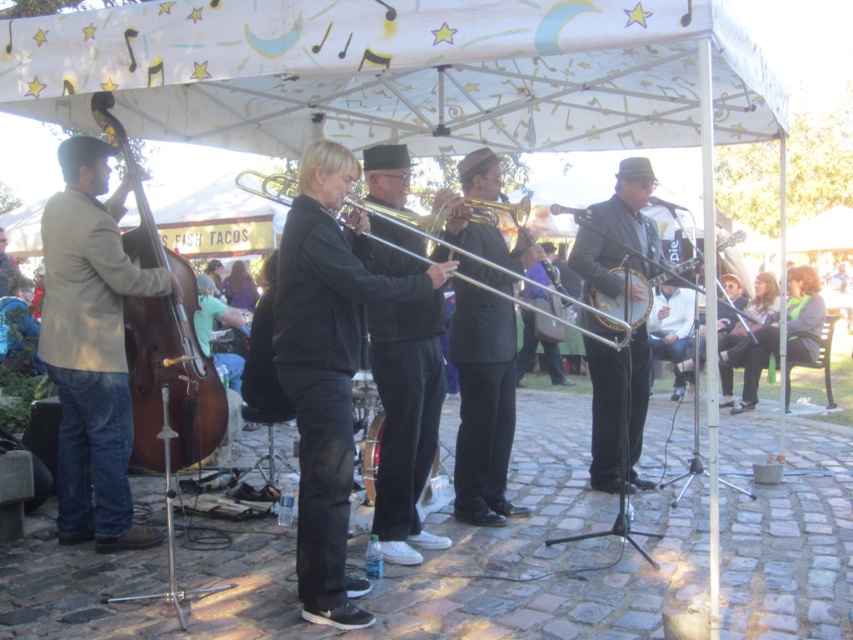
Question: Based on their relative distances, which object is farther from the brown polished wood double bass at left?

Choices:
 (A) shiny silver banjo at center
 (B) light brown leather jacket at left
 (C) silver metallic trombone at center

Answer: (A)

Question: Does shiny silver banjo at center have a lesser width compared to silver metallic trombone at center?

Choices:
 (A) yes
 (B) no

Answer: (B)

Question: Among these points, which one is nearest to the camera?

Choices:
 (A) click(254, 182)
 (B) click(161, 326)
 (C) click(640, 227)
 (D) click(428, 413)

Answer: (D)

Question: Is the position of shiny silver banjo at center more distant than that of shiny brass trombone at center?

Choices:
 (A) no
 (B) yes

Answer: (B)

Question: Where is light brown leather jacket at left located in relation to black matte trombone at center in the image?

Choices:
 (A) right
 (B) left

Answer: (B)

Question: Which of the following is the closest to the observer?

Choices:
 (A) black matte trombone at center
 (B) shiny brass trombone at center
 (C) brown polished wood double bass at left

Answer: (A)